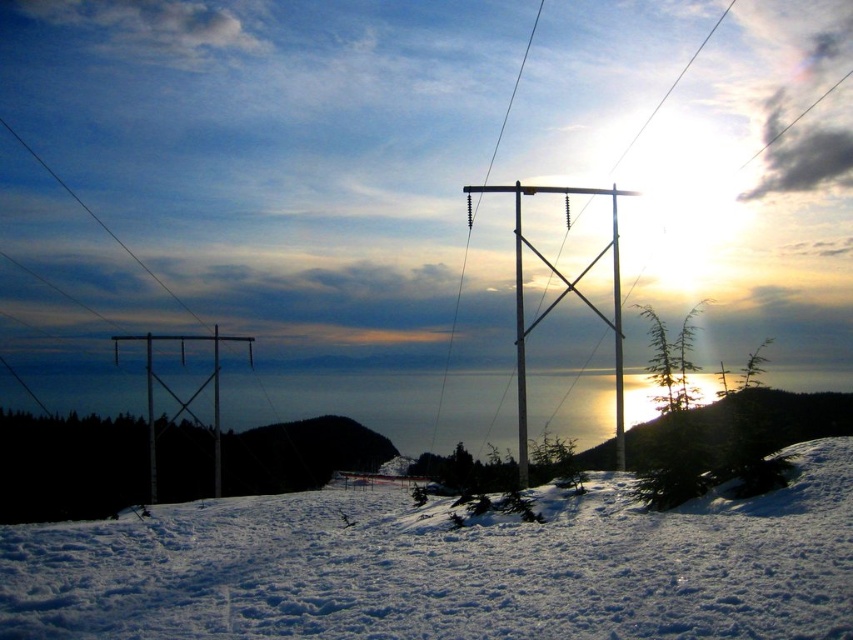
Who is shorter, white fluffy snow at center or metallic silver pole at center?

white fluffy snow at center

Does point (384, 593) lie behind point (432, 451)?

No, it is not.

Which is behind, point (762, 497) or point (483, 182)?

Positioned behind is point (483, 182).

Find the location of a particular element. This screenshot has width=853, height=640. white fluffy snow at center is located at coordinates click(x=447, y=566).

Does metallic silver telegraph pole at left have a larger size compared to metallic silver pole at center?

A: No, metallic silver telegraph pole at left is not bigger than metallic silver pole at center.

Is metallic silver telegraph pole at left wider than metallic silver pole at center?

Correct, the width of metallic silver telegraph pole at left exceeds that of metallic silver pole at center.

You are a GUI agent. You are given a task and a screenshot of the screen. Output one action in this format:
    pyautogui.click(x=<x>, y=<y>)
    Task: Click on the metallic silver telegraph pole at left
    This screenshot has height=640, width=853.
    Given the screenshot: What is the action you would take?
    pyautogui.click(x=161, y=384)

Is white fluffy snow at center bigger than metallic silver telegraph pole at left?

No.

Is point (132, 625) more distant than point (152, 448)?

That is False.

At what (x,y) coordinates should I click in order to perform the action: click on white fluffy snow at center. Please return your answer as a coordinate pair (x, y). Looking at the image, I should click on (447, 566).

In order to click on white fluffy snow at center in this screenshot , I will do `click(447, 566)`.